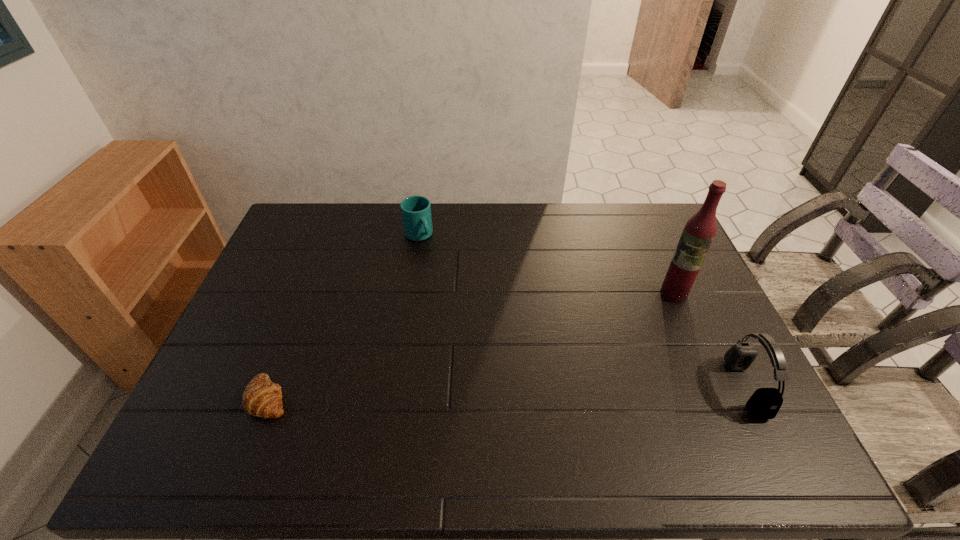
Where is `headset at the near edge`? headset at the near edge is located at coordinates (765, 403).

Find the location of a particular element. This screenshot has height=540, width=960. object positioned at the left edge is located at coordinates (262, 398).

Identify the location of headset that is at the right edge. (765, 403).

Locate an element on the screen. The image size is (960, 540). liquor that is at the right edge is located at coordinates (699, 231).

This screenshot has width=960, height=540. In order to click on object present at the near left corner in this screenshot , I will do `click(262, 398)`.

Where is `object at the near right corner`? object at the near right corner is located at coordinates (765, 403).

This screenshot has width=960, height=540. What are the coordinates of `vacant space at the far edge of the desktop` in the screenshot? It's located at [x=530, y=218].

At what (x,y) coordinates should I click in order to perform the action: click on vacant space at the near edge. Please return your answer as a coordinate pair (x, y). Image resolution: width=960 pixels, height=540 pixels. Looking at the image, I should click on (323, 424).

At what (x,y) coordinates should I click in order to perform the action: click on free location at the left edge. Please return your answer as a coordinate pair (x, y). Looking at the image, I should click on (235, 326).

At what (x,y) coordinates should I click in order to perform the action: click on vacant space at the right edge of the desktop. Please return your answer as a coordinate pair (x, y). This screenshot has height=540, width=960. Looking at the image, I should click on (659, 298).